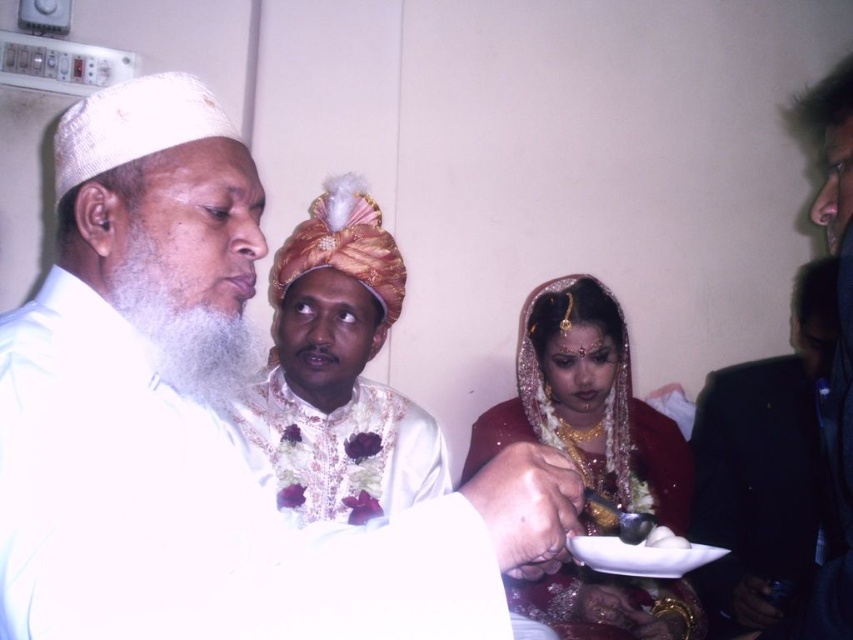
What are the coordinates of `white satin turban at center` in the screenshot? It's located at (339, 371).

Which is above, white satin turban at center or white glossy rice at lower center?

white satin turban at center

The width and height of the screenshot is (853, 640). In order to click on white satin turban at center in this screenshot , I will do `click(339, 371)`.

Does matte gold jewelry at center appear on the right side of black suit at right?

Incorrect, matte gold jewelry at center is not on the right side of black suit at right.

Who is lower down, matte gold jewelry at center or black suit at right?

Positioned lower is matte gold jewelry at center.

Where is `matte gold jewelry at center`? matte gold jewelry at center is located at coordinates (587, 403).

Can you confirm if white matte turban at upper left is positioned above white satin turban at center?

Incorrect, white matte turban at upper left is not positioned above white satin turban at center.

Is point (200, 472) less distant than point (384, 272)?

Yes, it is in front of point (384, 272).

This screenshot has height=640, width=853. I want to click on white matte turban at upper left, so click(x=202, y=424).